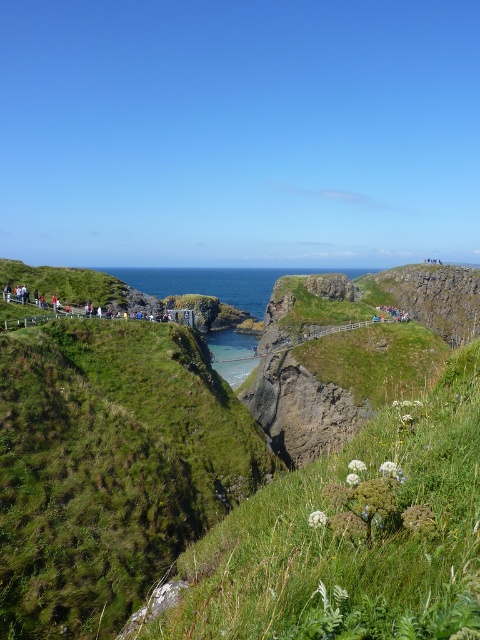
Question: Does blue water at center have a lesser width compared to dark brown wooden railing at left?

Choices:
 (A) yes
 (B) no

Answer: (B)

Question: Estimate the real-world distances between objects in this image. Which object is farther from the dark brown wooden railing at left?

Choices:
 (A) green grassy at center
 (B) blue water at center

Answer: (B)

Question: Which point is farther to the camera?

Choices:
 (A) dark brown wooden railing at left
 (B) blue water at center
 (C) green grassy at center

Answer: (B)

Question: Estimate the real-world distances between objects in this image. Which object is closer to the dark brown wooden railing at left?

Choices:
 (A) green grassy at center
 (B) blue water at center

Answer: (A)

Question: Is blue water at center smaller than dark brown wooden railing at left?

Choices:
 (A) no
 (B) yes

Answer: (A)

Question: Can you confirm if green grassy at center is positioned to the left of blue water at center?

Choices:
 (A) no
 (B) yes

Answer: (A)